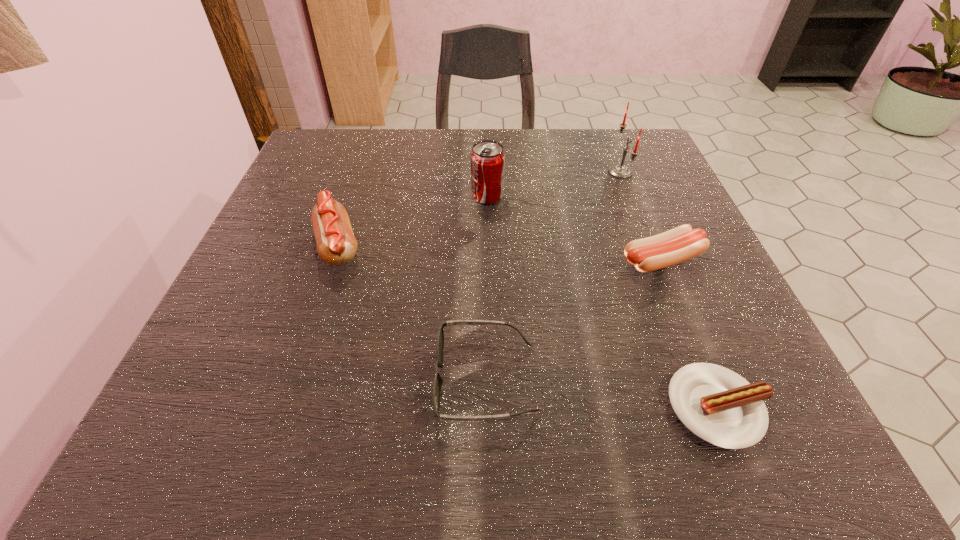
Find the location of `vacant space located 0.230m on the front-facing side of the candle`. vacant space located 0.230m on the front-facing side of the candle is located at coordinates pyautogui.click(x=506, y=172).

The image size is (960, 540). What are the coordinates of `free space located on the front of the pop soda` in the screenshot? It's located at (490, 303).

Locate an element on the screen. This screenshot has width=960, height=540. vacant space located 0.280m on the back of the leftmost sausage is located at coordinates (372, 145).

Locate an element on the screen. Image resolution: width=960 pixels, height=540 pixels. vacant space situated 0.180m on the back of the second tallest sausage is located at coordinates (631, 185).

Locate an element on the screen. This screenshot has height=540, width=960. free space located 0.150m on the front-facing side of the second shortest object is located at coordinates (330, 379).

Identify the location of vacant area situated 0.310m on the front-facing side of the second shortest object. (217, 379).

You are a GUI agent. You are given a task and a screenshot of the screen. Output one action in this format:
    pyautogui.click(x=<x>, y=<y>)
    Task: Click on the vacant space located 0.230m on the front-facing side of the second shortest object
    
    Given the screenshot: What is the action you would take?
    pyautogui.click(x=274, y=379)

The width and height of the screenshot is (960, 540). In order to click on free location located on the left of the shortest sausage in this screenshot , I will do `click(586, 407)`.

The width and height of the screenshot is (960, 540). In order to click on object present at the far edge in this screenshot , I will do `click(617, 170)`.

You are a GUI agent. You are given a task and a screenshot of the screen. Output one action in this format:
    pyautogui.click(x=<x>, y=<y>)
    Task: Click on the sunglasses that is at the near edge
    
    Given the screenshot: What is the action you would take?
    pyautogui.click(x=436, y=395)